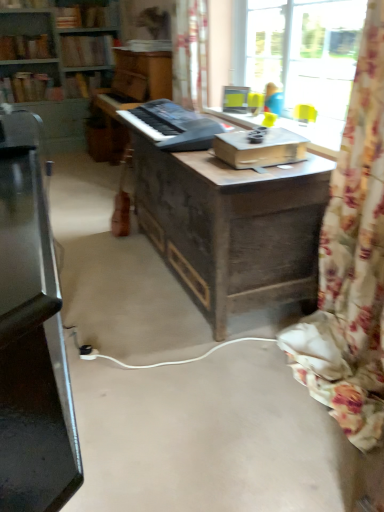
Question: From the image's perspective, relative to hardcover book at upper left, which ranks as the 5th book in bottom-to-top order, is hardcover book at upper left, which appears as the first book when viewed from the top, above or below?

Choices:
 (A) below
 (B) above

Answer: (B)

Question: In the image, is hardcover book at upper left, which appears as the first book when viewed from the top, on the left side or the right side of hardcover book at upper left, which ranks as the 5th book in bottom-to-top order?

Choices:
 (A) left
 (B) right

Answer: (A)

Question: Based on their relative distances, which object is nearer to the black plastic keyboard at center?

Choices:
 (A) wooden bookshelf at upper left, the 3th book from the top
 (B) wooden bookcase at upper left
 (C) brown cardboard book at center
 (D) wooden piano at center
 (E) hardcover book at upper left, arranged as the first book when ordered from the bottom

Answer: (C)

Question: Which is farther from the wooden bookshelf at upper left, arranged as the fourth book when viewed from the top?

Choices:
 (A) hardcover book at upper left, arranged as the first book when ordered from the bottom
 (B) wooden bookcase at upper left
 (C) dark wood table at center
 (D) hardcover book at center, which appears as the second book when ordered from the bottom
 (E) hardcover book at upper left, which ranks as the 5th book in bottom-to-top order

Answer: (C)